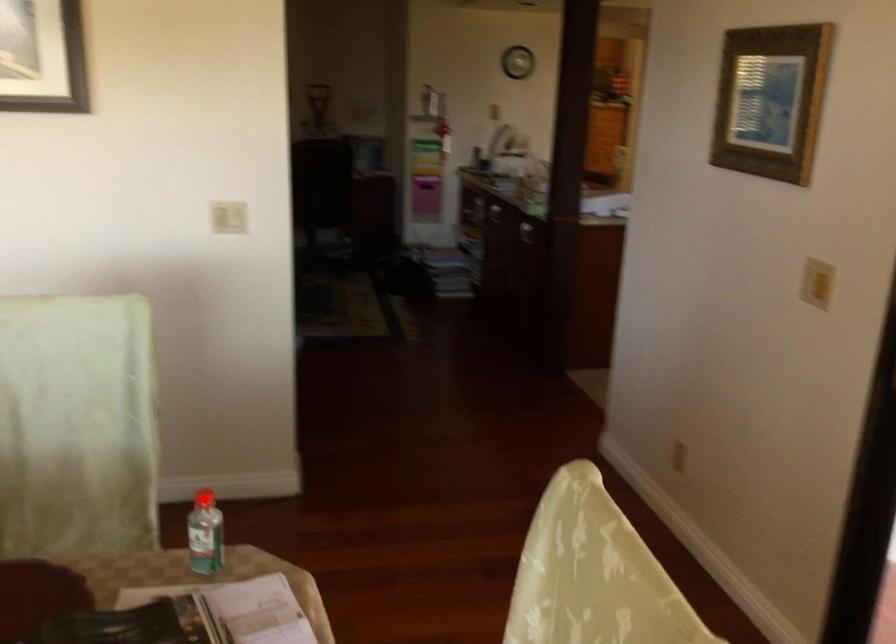
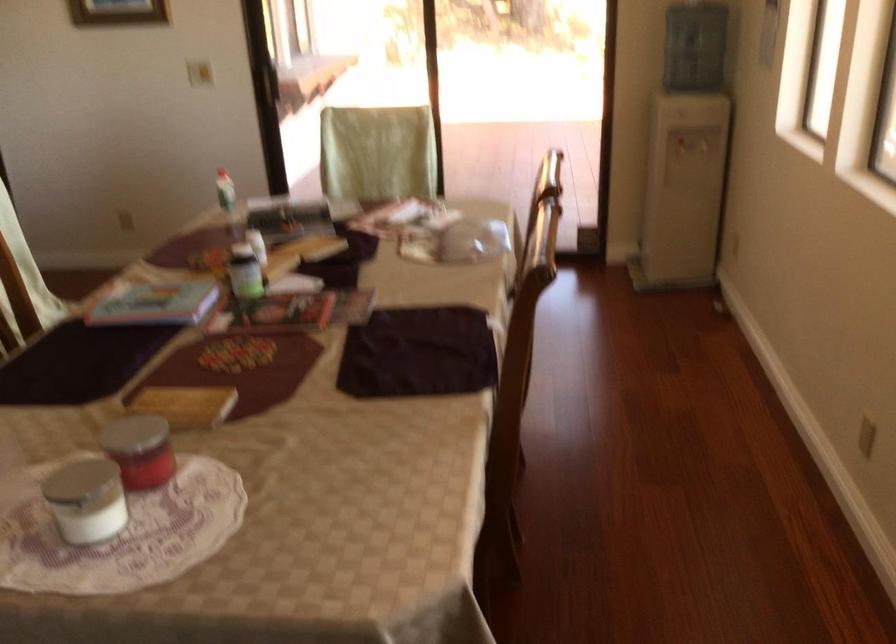
Question: I am providing you with two images of the same scene from different viewpoints. A red point is marked on the first image. At the location where the point appears in image 1, is it still visible in image 2?

Choices:
 (A) Yes
 (B) No

Answer: (B)